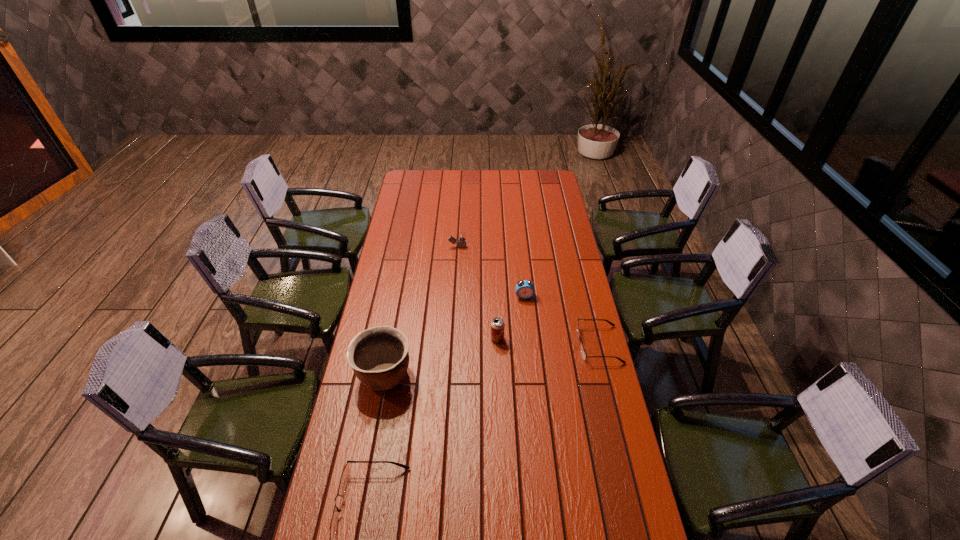
If equal spacing is desired by inserting an extra spectacles among them, please point out a free spot for this new spectacles. Please provide its 2D coordinates. Your answer should be formatted as a tuple, i.e. [(x, y)], where the tuple contains the x and y coordinates of a point satisfying the conditions above.

[(502, 414)]